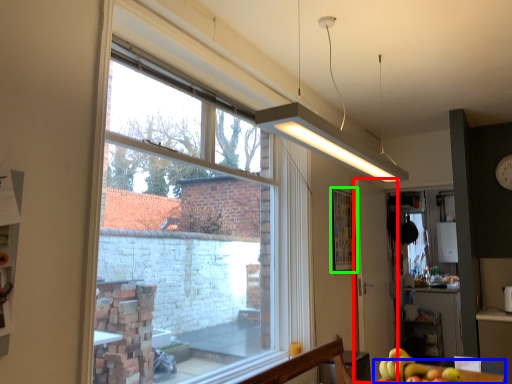
Question: Based on their relative distances, which object is farther from screen door (highlighted by a red box)? Choose from table (highlighted by a blue box) and bulletin board (highlighted by a green box).

Choices:
 (A) table
 (B) bulletin board

Answer: (A)